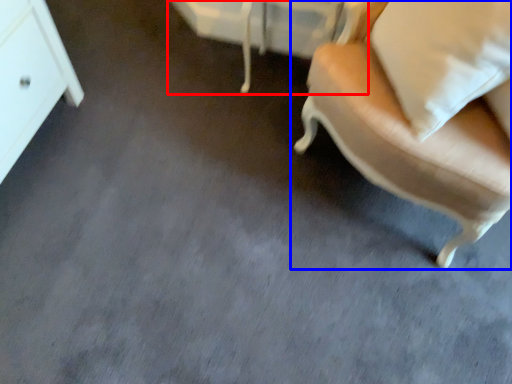
Question: Which point is closer to the camera, vanity (highlighted by a red box) or chair (highlighted by a blue box)?

Choices:
 (A) vanity
 (B) chair

Answer: (B)